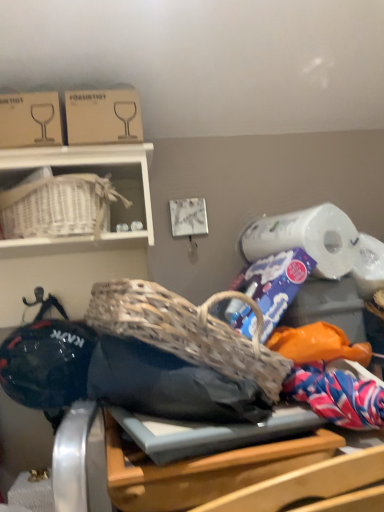
Question: Considering the relative sizes of cardboard box at upper left, positioned as the 2th cardboard box in left-to-right order, and cardboard box at upper left, arranged as the 2th cardboard box when viewed from the right, in the image provided, is cardboard box at upper left, positioned as the 2th cardboard box in left-to-right order, bigger than cardboard box at upper left, arranged as the 2th cardboard box when viewed from the right,?

Choices:
 (A) no
 (B) yes

Answer: (B)

Question: Is cardboard box at upper left, positioned as the 2th cardboard box in left-to-right order, turned away from cardboard box at upper left, the 1th cardboard box from the left?

Choices:
 (A) yes
 (B) no

Answer: (B)

Question: Considering the relative positions of cardboard box at upper left, which ranks as the 1th cardboard box in right-to-left order, and cardboard box at upper left, the 1th cardboard box from the left, in the image provided, is cardboard box at upper left, which ranks as the 1th cardboard box in right-to-left order, to the right of cardboard box at upper left, the 1th cardboard box from the left, from the viewer's perspective?

Choices:
 (A) yes
 (B) no

Answer: (A)

Question: Is cardboard box at upper left, positioned as the 2th cardboard box in left-to-right order, positioned far away from cardboard box at upper left, the 1th cardboard box from the left?

Choices:
 (A) yes
 (B) no

Answer: (B)

Question: Is the depth of cardboard box at upper left, which ranks as the 1th cardboard box in right-to-left order, less than that of cardboard box at upper left, the 1th cardboard box from the left?

Choices:
 (A) yes
 (B) no

Answer: (B)

Question: Considering the positions of cardboard box at upper left, the 1th cardboard box from the left, and cardboard box at upper left, which ranks as the 1th cardboard box in right-to-left order, in the image, is cardboard box at upper left, the 1th cardboard box from the left, taller or shorter than cardboard box at upper left, which ranks as the 1th cardboard box in right-to-left order,?

Choices:
 (A) tall
 (B) short

Answer: (A)

Question: Is point (41, 135) positioned closer to the camera than point (94, 106)?

Choices:
 (A) farther
 (B) closer

Answer: (B)

Question: Based on their positions, is cardboard box at upper left, the 1th cardboard box from the left, located to the left or right of cardboard box at upper left, positioned as the 2th cardboard box in left-to-right order?

Choices:
 (A) left
 (B) right

Answer: (A)

Question: Based on their sizes in the image, would you say cardboard box at upper left, the 1th cardboard box from the left, is bigger or smaller than cardboard box at upper left, positioned as the 2th cardboard box in left-to-right order?

Choices:
 (A) big
 (B) small

Answer: (B)

Question: From the image's perspective, is cardboard box at upper left, arranged as the 2th cardboard box when viewed from the right, positioned above or below white wicker basket at upper left?

Choices:
 (A) below
 (B) above

Answer: (B)

Question: Is cardboard box at upper left, arranged as the 2th cardboard box when viewed from the right, bigger or smaller than white wicker basket at upper left?

Choices:
 (A) small
 (B) big

Answer: (A)

Question: Considering the relative positions of cardboard box at upper left, the 1th cardboard box from the left, and white wicker basket at upper left in the image provided, is cardboard box at upper left, the 1th cardboard box from the left, to the left or to the right of white wicker basket at upper left?

Choices:
 (A) right
 (B) left

Answer: (B)

Question: Does point (34, 142) appear closer or farther from the camera than point (51, 159)?

Choices:
 (A) farther
 (B) closer

Answer: (B)

Question: Does point (112, 452) appear closer or farther from the camera than point (72, 104)?

Choices:
 (A) closer
 (B) farther

Answer: (A)

Question: In the image, is wooden table at center positioned in front of or behind cardboard box at upper left, positioned as the 2th cardboard box in left-to-right order?

Choices:
 (A) behind
 (B) front

Answer: (B)